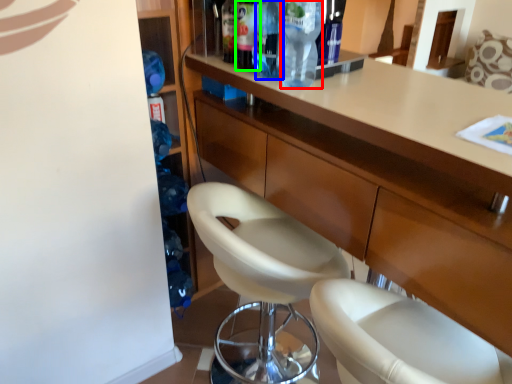
Question: Which object is the farthest from bottle (highlighted by a red box)? Choose among these: bottle (highlighted by a blue box) or bottle (highlighted by a green box).

Choices:
 (A) bottle
 (B) bottle

Answer: (B)